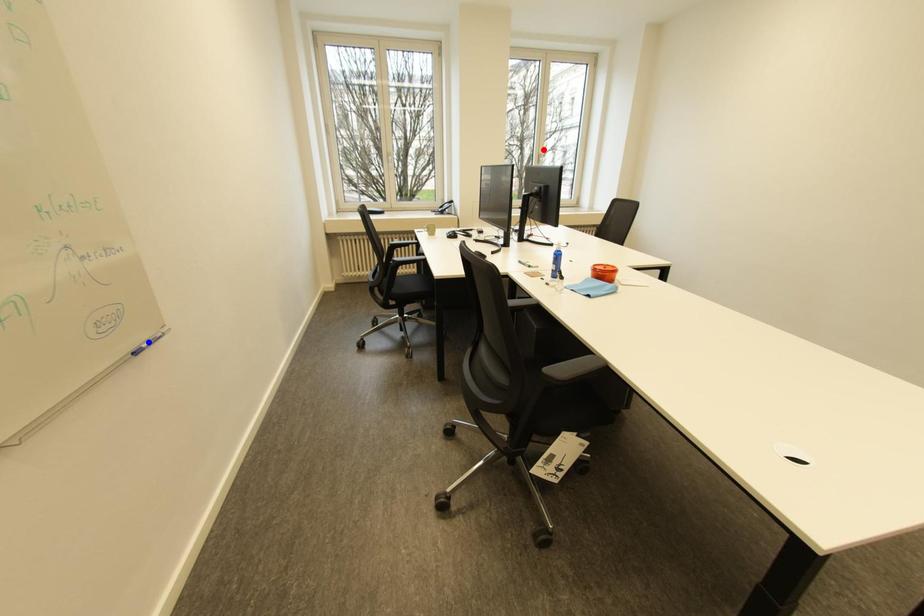
Question: In the image, two points are highlighted. Which point is nearer to the camera? Reply with the corresponding letter.

Choices:
 (A) blue point
 (B) red point

Answer: (A)